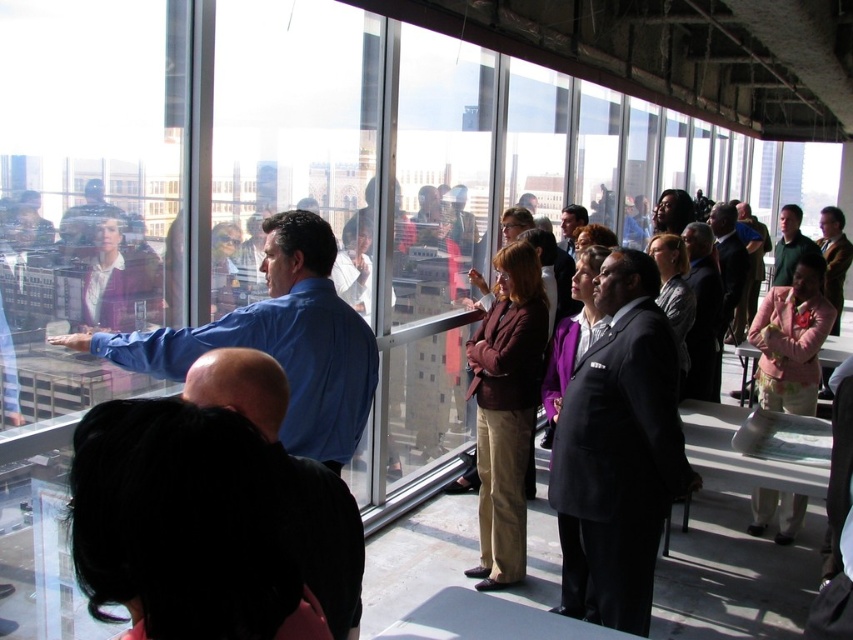
You are a photographer positioned in the room and want to take a photo that includes both the dark green shirt at right and the matte black suit at center. Which person should be closer to the camera to ensure both are in focus?

The dark green shirt at right is closer to the camera than the matte black suit at center. To ensure both are in focus, position the camera so the dark green shirt at right is the foreground subject and the matte black suit at center is in the background. This way, the depth of field will capture both clearly.

You are a photographer trying to capture a group photo of the dark green shirt at right and the matte black suit at center. Since you want both subjects to appear equally prominent in the photo, which subject should you move closer to the camera?

Since the dark green shirt at right is larger in size than matte black suit at center, you should move closer to the matte black suit at center to make it appear larger and balance the prominence between both subjects.

You are part of the group and want to hand a document to both the black matte shirt at lower left and the dark green shirt at right. Which person should you approach first if you are standing in the center of the group?

You should approach the black matte shirt at lower left first since they are positioned on the left side of the dark green shirt at right, meaning they are closer to your current position in the center.